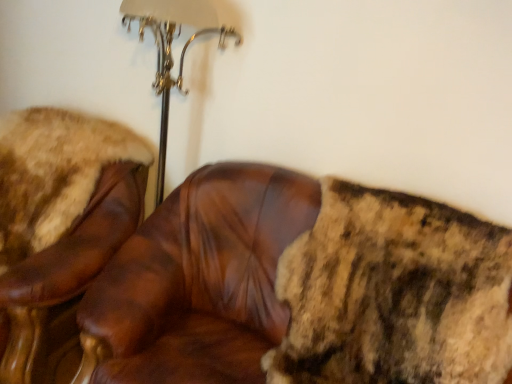
What do you see at coordinates (58, 229) in the screenshot? I see `brown leather chair at upper left, which is counted as the 1th chair, starting from the left` at bounding box center [58, 229].

How much space does brown leather chair at upper left, the 2th chair in the right-to-left sequence, occupy vertically?

brown leather chair at upper left, the 2th chair in the right-to-left sequence, is 38.36 inches in height.

At what (x,y) coordinates should I click in order to perform the action: click on brown leather chair at upper left, which is counted as the 1th chair, starting from the left. Please return your answer as a coordinate pair (x, y). Looking at the image, I should click on (58, 229).

The width and height of the screenshot is (512, 384). In order to click on brown leather chair at center, which ranks as the 2th chair in left-to-right order in this screenshot , I will do `click(296, 285)`.

Describe the element at coordinates (296, 285) in the screenshot. I see `brown leather chair at center, which ranks as the 2th chair in left-to-right order` at that location.

This screenshot has height=384, width=512. Identify the location of brown leather chair at upper left, which is counted as the 1th chair, starting from the left. (58, 229).

Which object is positioned more to the right, brown leather chair at upper left, the 2th chair in the right-to-left sequence, or brown leather chair at center, acting as the first chair starting from the right?

Positioned to the right is brown leather chair at center, acting as the first chair starting from the right.

Who is more distant, brown leather chair at upper left, which is counted as the 1th chair, starting from the left, or brown leather chair at center, which ranks as the 2th chair in left-to-right order?

brown leather chair at upper left, which is counted as the 1th chair, starting from the left, is further away from the camera.

Which is closer, (x=26, y=207) or (x=199, y=240)?

Point (x=26, y=207).

Based on the photo, from the image's perspective, is brown leather chair at upper left, the 2th chair in the right-to-left sequence, on top of brown leather chair at center, acting as the first chair starting from the right?

Yes, from the image's perspective, brown leather chair at upper left, the 2th chair in the right-to-left sequence, is on top of brown leather chair at center, acting as the first chair starting from the right.

From a real-world perspective, is brown leather chair at upper left, the 2th chair in the right-to-left sequence, located beneath brown leather chair at center, acting as the first chair starting from the right?

Correct, in the physical world, brown leather chair at upper left, the 2th chair in the right-to-left sequence, is lower than brown leather chair at center, acting as the first chair starting from the right.

Which of these two, brown leather chair at upper left, the 2th chair in the right-to-left sequence, or brown leather chair at center, which ranks as the 2th chair in left-to-right order, is thinner?

With smaller width is brown leather chair at center, which ranks as the 2th chair in left-to-right order.

Considering the relative sizes of brown leather chair at upper left, the 2th chair in the right-to-left sequence, and brown leather chair at center, which ranks as the 2th chair in left-to-right order, in the image provided, is brown leather chair at upper left, the 2th chair in the right-to-left sequence, shorter than brown leather chair at center, which ranks as the 2th chair in left-to-right order,?

Yes, brown leather chair at upper left, the 2th chair in the right-to-left sequence, is shorter than brown leather chair at center, which ranks as the 2th chair in left-to-right order.

Does brown leather chair at upper left, the 2th chair in the right-to-left sequence, have a smaller size compared to brown leather chair at center, which ranks as the 2th chair in left-to-right order?

Correct, brown leather chair at upper left, the 2th chair in the right-to-left sequence, occupies less space than brown leather chair at center, which ranks as the 2th chair in left-to-right order.

Is brown leather chair at upper left, the 2th chair in the right-to-left sequence, not inside brown leather chair at center, acting as the first chair starting from the right?

brown leather chair at upper left, the 2th chair in the right-to-left sequence, is positioned outside brown leather chair at center, acting as the first chair starting from the right.

Based on the photo, is the surface of brown leather chair at upper left, which is counted as the 1th chair, starting from the left, in direct contact with brown leather chair at center, acting as the first chair starting from the right?

No, brown leather chair at upper left, which is counted as the 1th chair, starting from the left, is not making contact with brown leather chair at center, acting as the first chair starting from the right.

Is brown leather chair at upper left, which is counted as the 1th chair, starting from the left, oriented away from brown leather chair at center, which ranks as the 2th chair in left-to-right order?

No, brown leather chair at upper left, which is counted as the 1th chair, starting from the left, is not facing the opposite direction of brown leather chair at center, which ranks as the 2th chair in left-to-right order.

What's the angular difference between brown leather chair at upper left, the 2th chair in the right-to-left sequence, and brown leather chair at center, which ranks as the 2th chair in left-to-right order,'s facing directions?

The facing directions of brown leather chair at upper left, the 2th chair in the right-to-left sequence, and brown leather chair at center, which ranks as the 2th chair in left-to-right order, are 0.000235 degrees apart.

Where is `chair below the brown leather chair at upper left, the 2th chair in the right-to-left sequence (from the image's perspective)`? The width and height of the screenshot is (512, 384). chair below the brown leather chair at upper left, the 2th chair in the right-to-left sequence (from the image's perspective) is located at coordinates coord(296,285).

From the picture: Considering the relative positions of brown leather chair at center, which ranks as the 2th chair in left-to-right order, and brown leather chair at upper left, the 2th chair in the right-to-left sequence, in the image provided, is brown leather chair at center, which ranks as the 2th chair in left-to-right order, to the left or to the right of brown leather chair at upper left, the 2th chair in the right-to-left sequence,?

brown leather chair at center, which ranks as the 2th chair in left-to-right order, is to the right of brown leather chair at upper left, the 2th chair in the right-to-left sequence.

Which object is further away from the camera taking this photo, brown leather chair at center, which ranks as the 2th chair in left-to-right order, or brown leather chair at upper left, the 2th chair in the right-to-left sequence?

brown leather chair at upper left, the 2th chair in the right-to-left sequence, is further from the camera.

Which is less distant, (270,213) or (25,294)?

Point (270,213) is farther from the camera than point (25,294).

From the image's perspective, between brown leather chair at center, acting as the first chair starting from the right, and brown leather chair at upper left, the 2th chair in the right-to-left sequence, which one is located above?

brown leather chair at upper left, the 2th chair in the right-to-left sequence, appears higher in the image.

From a real-world perspective, who is located lower, brown leather chair at center, which ranks as the 2th chair in left-to-right order, or brown leather chair at upper left, which is counted as the 1th chair, starting from the left?

In real-world perspective, brown leather chair at upper left, which is counted as the 1th chair, starting from the left, is lower.

Which of these two, brown leather chair at center, which ranks as the 2th chair in left-to-right order, or brown leather chair at upper left, the 2th chair in the right-to-left sequence, is wider?

Wider between the two is brown leather chair at upper left, the 2th chair in the right-to-left sequence.

Is brown leather chair at center, acting as the first chair starting from the right, shorter than brown leather chair at upper left, which is counted as the 1th chair, starting from the left?

No, brown leather chair at center, acting as the first chair starting from the right, is not shorter than brown leather chair at upper left, which is counted as the 1th chair, starting from the left.

Who is bigger, brown leather chair at center, acting as the first chair starting from the right, or brown leather chair at upper left, the 2th chair in the right-to-left sequence?

brown leather chair at center, acting as the first chair starting from the right.

Can we say brown leather chair at center, which ranks as the 2th chair in left-to-right order, lies outside brown leather chair at upper left, the 2th chair in the right-to-left sequence?

Yes, brown leather chair at center, which ranks as the 2th chair in left-to-right order, is not within brown leather chair at upper left, the 2th chair in the right-to-left sequence.

Is brown leather chair at center, acting as the first chair starting from the right, next to brown leather chair at upper left, the 2th chair in the right-to-left sequence, and touching it?

No, brown leather chair at center, acting as the first chair starting from the right, is not beside brown leather chair at upper left, the 2th chair in the right-to-left sequence.

Is brown leather chair at center, acting as the first chair starting from the right, turned away from brown leather chair at upper left, which is counted as the 1th chair, starting from the left?

No, brown leather chair at center, acting as the first chair starting from the right, is not facing the opposite direction of brown leather chair at upper left, which is counted as the 1th chair, starting from the left.

How different are the orientations of brown leather chair at center, acting as the first chair starting from the right, and brown leather chair at upper left, the 2th chair in the right-to-left sequence, in degrees?

There is a 0.000235-degree angle between the facing directions of brown leather chair at center, acting as the first chair starting from the right, and brown leather chair at upper left, the 2th chair in the right-to-left sequence.

What are the coordinates of `chair above the brown leather chair at upper left, the 2th chair in the right-to-left sequence (from a real-world perspective)` in the screenshot? It's located at (296, 285).

Locate an element on the screen. chair in front of the brown leather chair at upper left, which is counted as the 1th chair, starting from the left is located at coordinates (296, 285).

Find the location of `chair on the right side of brown leather chair at upper left, which is counted as the 1th chair, starting from the left`. chair on the right side of brown leather chair at upper left, which is counted as the 1th chair, starting from the left is located at coordinates (296, 285).